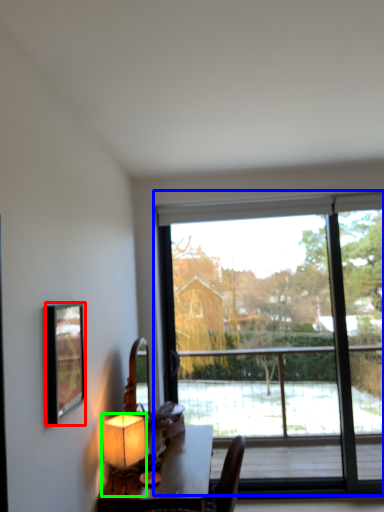
Question: Estimate the real-world distances between objects in this image. Which object is farther from picture frame (highlighted by a red box), window (highlighted by a blue box) or lamp (highlighted by a green box)?

Choices:
 (A) window
 (B) lamp

Answer: (A)